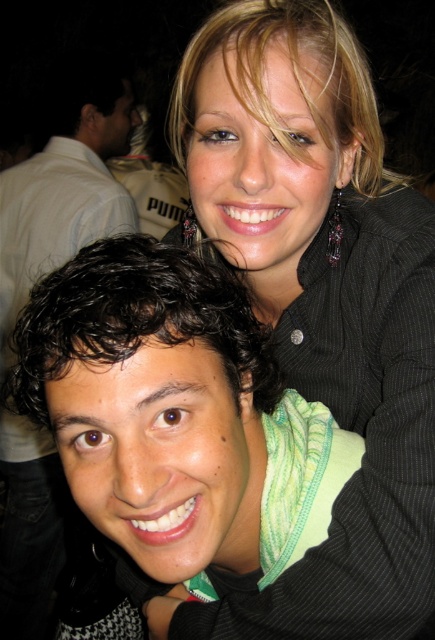
Does black pinstripe jacket at upper right have a greater width compared to dark curly hair at left?

No.

Between black pinstripe jacket at upper right and dark curly hair at left, which one is positioned lower?

dark curly hair at left

Find the location of a particular element. black pinstripe jacket at upper right is located at coordinates (321, 298).